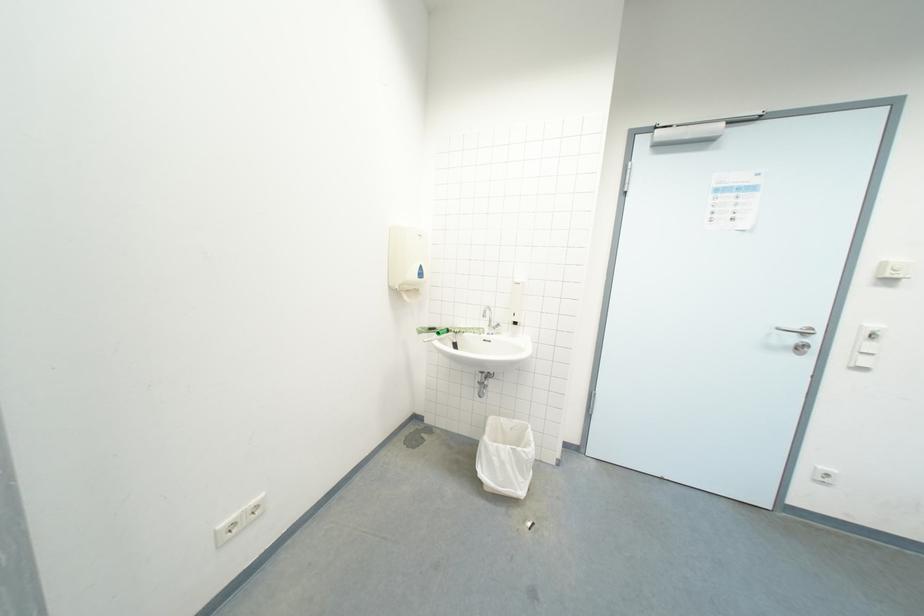
I want to click on white trash can, so click(505, 456).